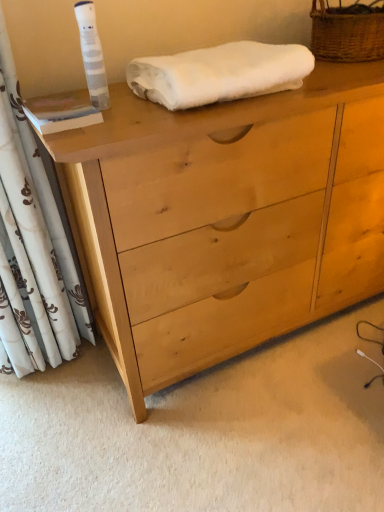
Question: From the image's perspective, is white floral fabric curtain at left positioned above or below light wood chest of drawers at center?

Choices:
 (A) above
 (B) below

Answer: (B)

Question: From a real-world perspective, is white floral fabric curtain at left positioned above or below light wood chest of drawers at center?

Choices:
 (A) above
 (B) below

Answer: (A)

Question: Which of these objects is positioned closest to the woven brown basket at upper right?

Choices:
 (A) light wood chest of drawers at center
 (B) white floral fabric curtain at left
 (C) white fluffy towel at upper center

Answer: (C)

Question: Considering the real-world distances, which object is farthest from the white floral fabric curtain at left?

Choices:
 (A) white fluffy towel at upper center
 (B) light wood chest of drawers at center
 (C) woven brown basket at upper right

Answer: (C)